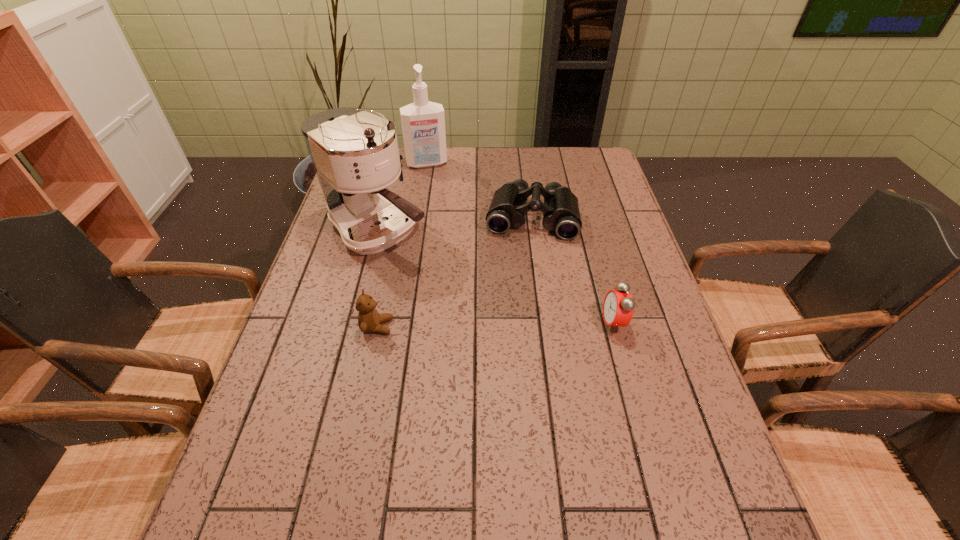
This screenshot has width=960, height=540. Identify the location of teddy bear. (369, 320).

Where is `alarm clock`? alarm clock is located at coordinates [x=618, y=307].

Identify the location of the farthest object. (423, 122).

The width and height of the screenshot is (960, 540). In order to click on coffee maker in this screenshot , I will do `click(355, 154)`.

Where is `binoculars`? binoculars is located at coordinates (560, 209).

Locate an element on the screen. This screenshot has width=960, height=540. free space located 0.330m on the front-facing side of the teddy bear is located at coordinates (530, 327).

The height and width of the screenshot is (540, 960). Find the location of `free location located on the front-facing side of the alarm clock`. free location located on the front-facing side of the alarm clock is located at coordinates (444, 323).

This screenshot has width=960, height=540. Find the location of `vacant space located on the front-facing side of the alarm clock`. vacant space located on the front-facing side of the alarm clock is located at coordinates (544, 323).

You are a GUI agent. You are given a task and a screenshot of the screen. Output one action in this format:
    pyautogui.click(x=<x>, y=<y>)
    Task: Click on the vacant position located 0.120m on the front-facing side of the alarm clock
    Image resolution: width=960 pixels, height=540 pixels.
    Given the screenshot: What is the action you would take?
    point(553,323)

The width and height of the screenshot is (960, 540). In order to click on blank area located 0.210m on the front label of the farthest object in this screenshot , I will do `click(440, 205)`.